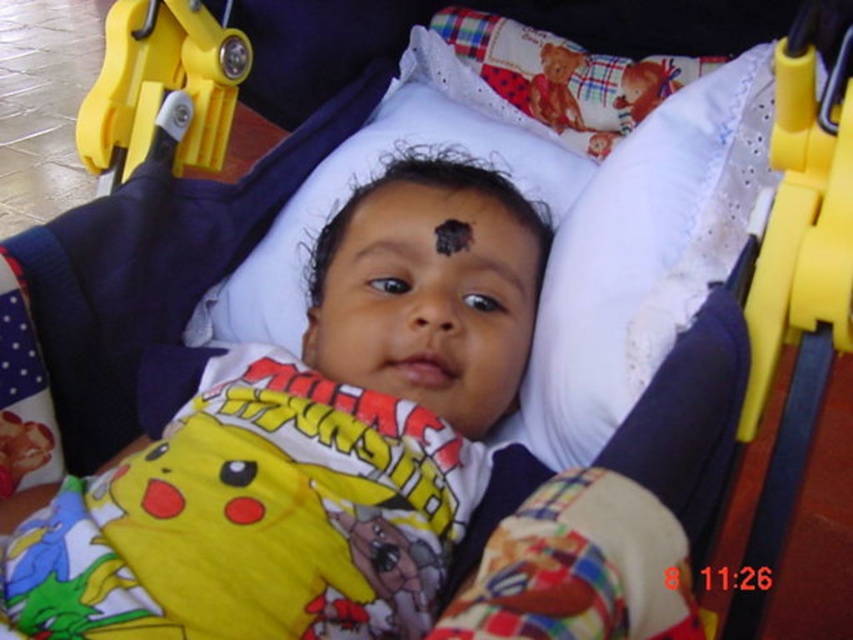
Describe the element at coordinates (643, 257) in the screenshot. I see `white lace pillow at upper center` at that location.

Does white lace pillow at upper center have a smaller size compared to yellow plastic stroller at right?

Actually, white lace pillow at upper center might be larger than yellow plastic stroller at right.

Where is `white lace pillow at upper center`? The width and height of the screenshot is (853, 640). white lace pillow at upper center is located at coordinates (643, 257).

Between yellow cotton shirt at center and yellow plastic stroller at right, which one appears on the right side from the viewer's perspective?

yellow plastic stroller at right

Does yellow cotton shirt at center have a greater height compared to yellow plastic stroller at right?

Yes.

Between point (372, 296) and point (796, 60), which one is positioned behind?

Positioned behind is point (372, 296).

Find the location of a particular element. The height and width of the screenshot is (640, 853). yellow cotton shirt at center is located at coordinates pos(317,442).

Does white lace pillow at upper center have a lesser height compared to yellow plastic buckle at upper left?

No, white lace pillow at upper center is not shorter than yellow plastic buckle at upper left.

Does white lace pillow at upper center have a smaller size compared to yellow plastic buckle at upper left?

No, white lace pillow at upper center is not smaller than yellow plastic buckle at upper left.

Identify the location of white lace pillow at upper center. (643, 257).

The height and width of the screenshot is (640, 853). Find the location of `white lace pillow at upper center`. white lace pillow at upper center is located at coordinates (643, 257).